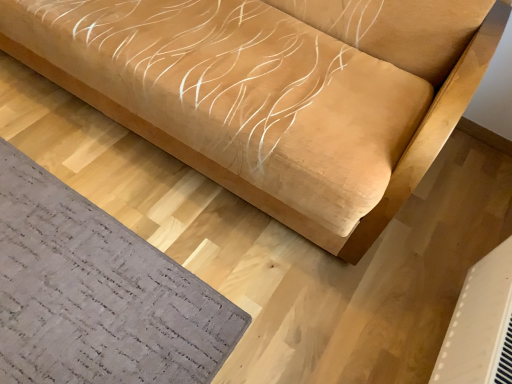
Identify the location of free spot to the right of gray textured mat at lower left. (298, 281).